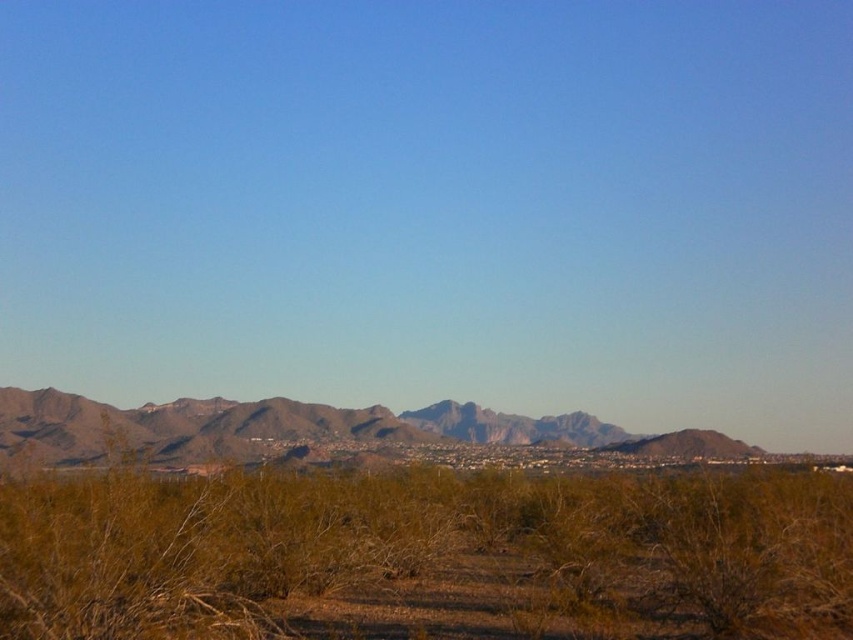
Question: Does brown shrubbery at center appear on the right side of brown rocky mountains at center?

Choices:
 (A) yes
 (B) no

Answer: (A)

Question: Is brown shrubbery at center thinner than brown rocky mountains at center?

Choices:
 (A) no
 (B) yes

Answer: (B)

Question: Among these points, which one is nearest to the camera?

Choices:
 (A) (555, 445)
 (B) (111, 628)

Answer: (B)

Question: Which point is closer to the camera?

Choices:
 (A) brown shrubbery at center
 (B) brown rocky mountains at center

Answer: (A)

Question: Which point is farther from the camera taking this photo?

Choices:
 (A) (326, 424)
 (B) (625, 611)

Answer: (A)

Question: Can you confirm if brown shrubbery at center is positioned above brown rocky mountains at center?

Choices:
 (A) yes
 (B) no

Answer: (A)